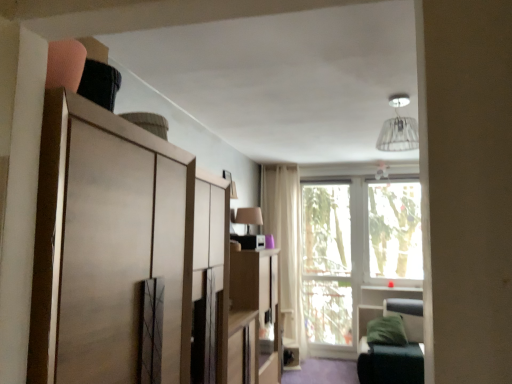
Question: Does green leather bunk bed at lower right have a smaller size compared to wooden cabinet at center, marked as the 1th cabinetry in a bottom-to-top arrangement?

Choices:
 (A) no
 (B) yes

Answer: (A)

Question: Considering the relative sizes of green leather bunk bed at lower right and wooden cabinet at center, the second cabinetry viewed from the left, in the image provided, is green leather bunk bed at lower right bigger than wooden cabinet at center, the second cabinetry viewed from the left,?

Choices:
 (A) no
 (B) yes

Answer: (B)

Question: Is green leather bunk bed at lower right to the right of wooden cabinet at center, which is counted as the first cabinetry, starting from the back, from the viewer's perspective?

Choices:
 (A) no
 (B) yes

Answer: (B)

Question: Would you consider green leather bunk bed at lower right to be distant from wooden cabinet at center, marked as the 1th cabinetry in a bottom-to-top arrangement?

Choices:
 (A) no
 (B) yes

Answer: (B)

Question: Is green leather bunk bed at lower right next to wooden cabinet at center, positioned as the first cabinetry in right-to-left order, and touching it?

Choices:
 (A) yes
 (B) no

Answer: (B)

Question: Can you confirm if green leather bunk bed at lower right is thinner than wooden cabinet at center, which is counted as the first cabinetry, starting from the back?

Choices:
 (A) no
 (B) yes

Answer: (A)

Question: From a real-world perspective, is white fabric lampshade at upper center physically below transparent glass window at center, which appears as the second window screen when viewed from the left?

Choices:
 (A) yes
 (B) no

Answer: (B)

Question: Is white fabric lampshade at upper center oriented away from transparent glass window at center, which appears as the second window screen when viewed from the left?

Choices:
 (A) no
 (B) yes

Answer: (B)

Question: Is white fabric lampshade at upper center completely or partially outside of transparent glass window at center, which appears as the second window screen when viewed from the left?

Choices:
 (A) yes
 (B) no

Answer: (A)

Question: Is white fabric lampshade at upper center taller than transparent glass window at center, which appears as the second window screen when viewed from the left?

Choices:
 (A) no
 (B) yes

Answer: (A)

Question: Considering the relative sizes of white fabric lampshade at upper center and transparent glass window at center, the 1th window screen when ordered from right to left, in the image provided, is white fabric lampshade at upper center thinner than transparent glass window at center, the 1th window screen when ordered from right to left,?

Choices:
 (A) yes
 (B) no

Answer: (B)

Question: Is white fabric lampshade at upper center shorter than transparent glass window at center, which appears as the second window screen when viewed from the left?

Choices:
 (A) yes
 (B) no

Answer: (A)

Question: Is white fabric lampshade at upper center behind wooden cabinet at center, marked as the 2th cabinetry in a top-to-bottom arrangement?

Choices:
 (A) yes
 (B) no

Answer: (B)